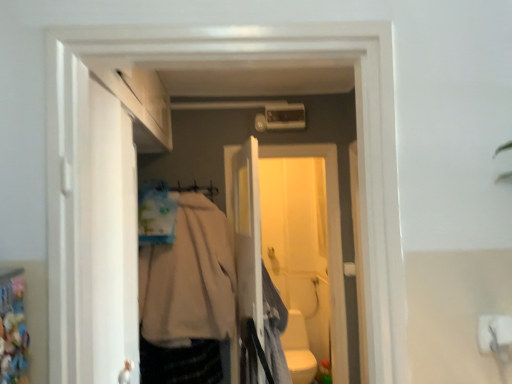
Describe the element at coordinates (90, 226) in the screenshot. I see `white matte door at left` at that location.

What do you see at coordinates (274, 329) in the screenshot?
I see `light gray fabric at center, marked as the 1th clothing in a right-to-left arrangement` at bounding box center [274, 329].

In order to face light gray fabric at center, marked as the 1th clothing in a right-to-left arrangement, should I rotate leftwards or rightwards?

Rotate right and turn 3.468 degrees.

This screenshot has height=384, width=512. What do you see at coordinates (247, 256) in the screenshot?
I see `white plastic screen door at center, which ranks as the second screen door in back-to-front order` at bounding box center [247, 256].

Find the location of `white plastic screen door at center, the first screen door viewed from the back`. white plastic screen door at center, the first screen door viewed from the back is located at coordinates (328, 237).

This screenshot has height=384, width=512. What do you see at coordinates (187, 297) in the screenshot?
I see `beige fabric coat at center, the second clothing in the right-to-left sequence` at bounding box center [187, 297].

This screenshot has width=512, height=384. Describe the element at coordinates (197, 189) in the screenshot. I see `beige fabric hanger at center` at that location.

Image resolution: width=512 pixels, height=384 pixels. Identify the location of white matte door at left. (90, 226).

Would you say white plastic screen door at center, which is counted as the first screen door, starting from the front, is to the left or to the right of beige fabric coat at center, the second clothing in the right-to-left sequence, in the picture?

From the image, it's evident that white plastic screen door at center, which is counted as the first screen door, starting from the front, is to the right of beige fabric coat at center, the second clothing in the right-to-left sequence.

You are a GUI agent. You are given a task and a screenshot of the screen. Output one action in this format:
    pyautogui.click(x=<x>, y=<y>)
    Task: Click on the clothing on the left side of white plastic screen door at center, which is counted as the first screen door, starting from the front
    The image size is (512, 384).
    Given the screenshot: What is the action you would take?
    pyautogui.click(x=187, y=297)

How distant is white plastic screen door at center, which ranks as the second screen door in back-to-front order, from beige fabric coat at center, the second clothing in the right-to-left sequence?

The distance of white plastic screen door at center, which ranks as the second screen door in back-to-front order, from beige fabric coat at center, the second clothing in the right-to-left sequence, is 32.40 centimeters.

In the scene shown: Is white glossy toilet bowl at lower center facing towards white matte door at left?

Yes, white glossy toilet bowl at lower center is facing white matte door at left.

Considering their positions, is white glossy toilet bowl at lower center located in front of or behind white matte door at left?

Visually, white glossy toilet bowl at lower center is located behind white matte door at left.

Does white glossy toilet bowl at lower center appear on the right side of white matte door at left?

Yes, white glossy toilet bowl at lower center is to the right of white matte door at left.

Locate an element on the screen. door lying in front of the white glossy toilet bowl at lower center is located at coordinates (90, 226).

Is the depth of white matte door at left greater than that of white glossy toilet bowl at lower center?

No, it is not.

Based on the photo, can you confirm if white matte door at left is bigger than white glossy toilet bowl at lower center?

Indeed, white matte door at left has a larger size compared to white glossy toilet bowl at lower center.

In the scene shown: Are white matte door at left and white glossy toilet bowl at lower center making contact?

Answer: They are not placed beside each other.

Considering their positions, is white plastic screen door at center, which ranks as the second screen door in back-to-front order, located in front of or behind white glossy toilet bowl at lower center?

Clearly, white plastic screen door at center, which ranks as the second screen door in back-to-front order, is in front of white glossy toilet bowl at lower center.

How different are the orientations of white plastic screen door at center, which is counted as the first screen door, starting from the front, and white glossy toilet bowl at lower center in degrees?

105 degrees.

Between white plastic screen door at center, which ranks as the second screen door in back-to-front order, and white glossy toilet bowl at lower center, which one has more height?

Standing taller between the two is white plastic screen door at center, which ranks as the second screen door in back-to-front order.

From the image's perspective, which one is positioned lower, white plastic screen door at center, which ranks as the second screen door in back-to-front order, or white glossy toilet bowl at lower center?

white glossy toilet bowl at lower center appears lower in the image.

Consider the image. Is beige fabric coat at center, acting as the first clothing starting from the left, oriented towards beige fabric hanger at center?

No, beige fabric coat at center, acting as the first clothing starting from the left, does not turn towards beige fabric hanger at center.

Does beige fabric coat at center, the second clothing in the right-to-left sequence, appear on the right side of beige fabric hanger at center?

Yes.

Is beige fabric coat at center, the second clothing in the right-to-left sequence, far away from beige fabric hanger at center?

No, beige fabric coat at center, the second clothing in the right-to-left sequence, is in close proximity to beige fabric hanger at center.

Could you tell me if beige fabric hanger at center is turned towards white matte door at left?

Yes, beige fabric hanger at center is oriented towards white matte door at left.

Considering the relative sizes of beige fabric hanger at center and white matte door at left in the image provided, is beige fabric hanger at center wider than white matte door at left?

No, beige fabric hanger at center is not wider than white matte door at left.

From a real-world perspective, which is physically below, beige fabric hanger at center or white matte door at left?

white matte door at left is physically lower.

Is point (303, 355) positioned behind point (269, 302)?

Yes.

Is white glossy toilet bowl at lower center turned away from light gray fabric at center, marked as the 1th clothing in a right-to-left arrangement?

white glossy toilet bowl at lower center does not have its back to light gray fabric at center, marked as the 1th clothing in a right-to-left arrangement.

Can you tell me how much white glossy toilet bowl at lower center and light gray fabric at center, which is the 2th clothing in left-to-right order, differ in facing direction?

There is a 15-degree angle between the facing directions of white glossy toilet bowl at lower center and light gray fabric at center, which is the 2th clothing in left-to-right order.

Locate an element on the screen. toilet bowl below the light gray fabric at center, marked as the 1th clothing in a right-to-left arrangement (from a real-world perspective) is located at coordinates (298, 349).

At what (x,y) coordinates should I click in order to perform the action: click on the 2nd screen door positioned above the beige fabric coat at center, acting as the first clothing starting from the left (from the image's perspective). Please return your answer as a coordinate pair (x, y). Looking at the image, I should click on (247, 256).

In order to click on toilet bowl below the white matte door at left (from the image's perspective) in this screenshot , I will do `click(298, 349)`.

From the image, which object appears to be nearer to white plastic screen door at center, acting as the 2th screen door starting from the front, light gray fabric at center, marked as the 1th clothing in a right-to-left arrangement, or beige fabric coat at center, acting as the first clothing starting from the left?

The object closer to white plastic screen door at center, acting as the 2th screen door starting from the front, is beige fabric coat at center, acting as the first clothing starting from the left.

Based on their spatial positions, is white glossy toilet bowl at lower center or white plastic screen door at center, which ranks as the second screen door in back-to-front order, further from white plastic screen door at center, the first screen door viewed from the back?

Based on the image, white glossy toilet bowl at lower center appears to be further to white plastic screen door at center, the first screen door viewed from the back.

Estimate the real-world distances between objects in this image. Which object is closer to white glossy toilet bowl at lower center, beige fabric hanger at center or beige fabric coat at center, the second clothing in the right-to-left sequence?

beige fabric coat at center, the second clothing in the right-to-left sequence, is closer to white glossy toilet bowl at lower center.

Looking at the image, which one is located closer to beige fabric coat at center, the second clothing in the right-to-left sequence, white plastic screen door at center, which is counted as the first screen door, starting from the front, or light gray fabric at center, marked as the 1th clothing in a right-to-left arrangement?

Based on the image, white plastic screen door at center, which is counted as the first screen door, starting from the front, appears to be nearer to beige fabric coat at center, the second clothing in the right-to-left sequence.

From the image, which object appears to be nearer to beige fabric coat at center, the second clothing in the right-to-left sequence, light gray fabric at center, marked as the 1th clothing in a right-to-left arrangement, or white plastic screen door at center, which is counted as the first screen door, starting from the front?

white plastic screen door at center, which is counted as the first screen door, starting from the front.

Based on their spatial positions, is white glossy toilet bowl at lower center or beige fabric hanger at center further from white plastic screen door at center, which ranks as the second screen door in back-to-front order?

Among the two, white glossy toilet bowl at lower center is located further to white plastic screen door at center, which ranks as the second screen door in back-to-front order.

Which object lies further to the anchor point beige fabric hanger at center, white glossy toilet bowl at lower center or light gray fabric at center, marked as the 1th clothing in a right-to-left arrangement?

white glossy toilet bowl at lower center is positioned further to the anchor beige fabric hanger at center.

Consider the image. Considering their positions, is white glossy toilet bowl at lower center positioned further to beige fabric coat at center, the second clothing in the right-to-left sequence, than white plastic screen door at center, which is counted as the first screen door, starting from the front?

The object further to beige fabric coat at center, the second clothing in the right-to-left sequence, is white glossy toilet bowl at lower center.

Where is `screen door between white matte door at left and beige fabric hanger at center from front to back`? screen door between white matte door at left and beige fabric hanger at center from front to back is located at coordinates (247, 256).

The height and width of the screenshot is (384, 512). Find the location of `clothing between white matte door at left and beige fabric coat at center, acting as the first clothing starting from the left, along the z-axis`. clothing between white matte door at left and beige fabric coat at center, acting as the first clothing starting from the left, along the z-axis is located at coordinates (274, 329).

Find the location of a particular element. This screenshot has width=512, height=384. screen door located between white matte door at left and beige fabric coat at center, the second clothing in the right-to-left sequence, in the depth direction is located at coordinates (247, 256).

The image size is (512, 384). Find the location of `clothing between light gray fabric at center, marked as the 1th clothing in a right-to-left arrangement, and white glossy toilet bowl at lower center in the front-back direction`. clothing between light gray fabric at center, marked as the 1th clothing in a right-to-left arrangement, and white glossy toilet bowl at lower center in the front-back direction is located at coordinates (187, 297).